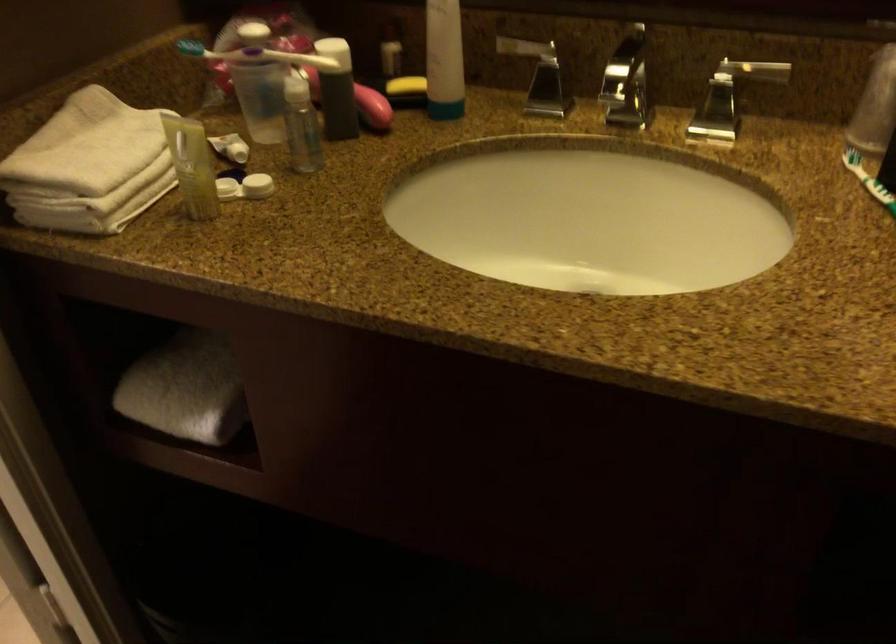
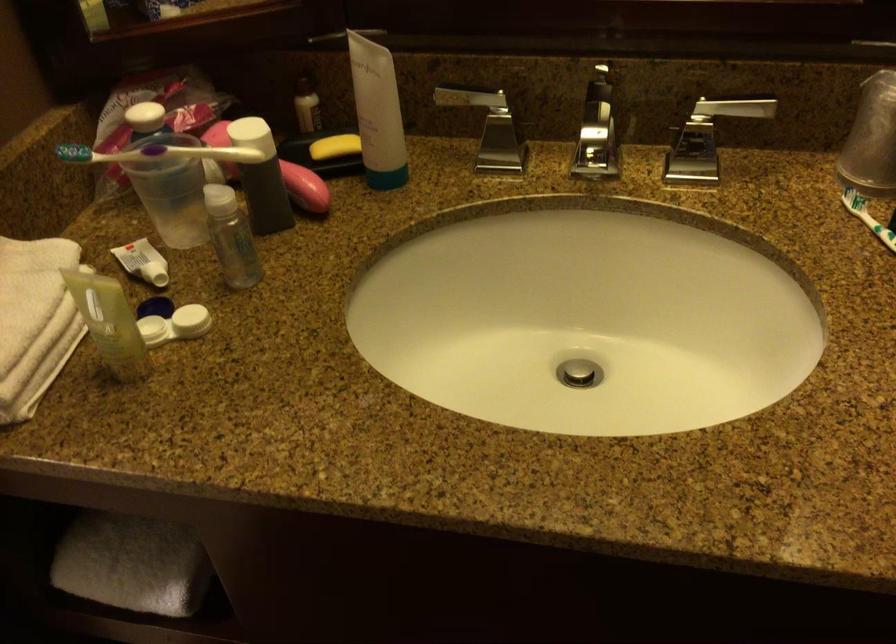
Question: The camera is either moving clockwise (left) or counter-clockwise (right) around the object. The first image is from the beginning of the video and the second image is from the end. Is the camera moving left or right when shooting the video?

Choices:
 (A) Left
 (B) Right

Answer: (A)